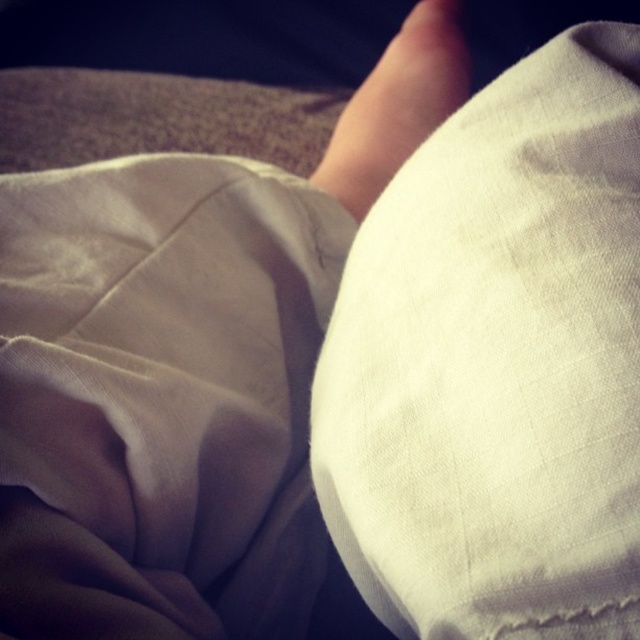
Question: Which object is the farthest from the skinny beige foot at center?

Choices:
 (A) white cotton blanket at lower left
 (B) white cotton pillow at center

Answer: (B)

Question: Is white cotton blanket at lower left in front of skinny beige foot at center?

Choices:
 (A) no
 (B) yes

Answer: (B)

Question: Does white cotton blanket at lower left appear on the left side of skinny beige foot at center?

Choices:
 (A) yes
 (B) no

Answer: (A)

Question: Which object is closer to the camera taking this photo?

Choices:
 (A) white cotton pillow at center
 (B) skinny beige foot at center
 (C) white cotton blanket at lower left

Answer: (A)

Question: Which point appears closest to the camera in this image?

Choices:
 (A) (61, 577)
 (B) (417, 554)

Answer: (B)

Question: Can you confirm if white cotton pillow at center is positioned above white cotton blanket at lower left?

Choices:
 (A) no
 (B) yes

Answer: (B)